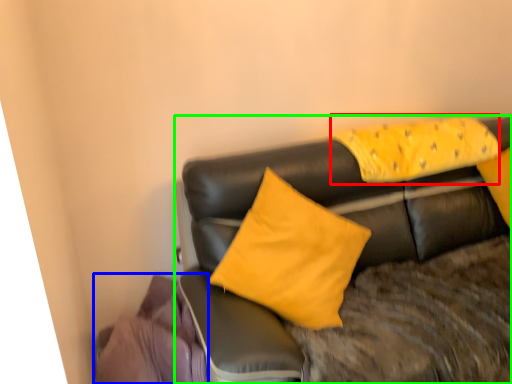
Question: Based on their relative distances, which object is nearer to pillow (highlighted by a red box)? Choose from material (highlighted by a blue box) and studio couch (highlighted by a green box).

Choices:
 (A) material
 (B) studio couch

Answer: (B)